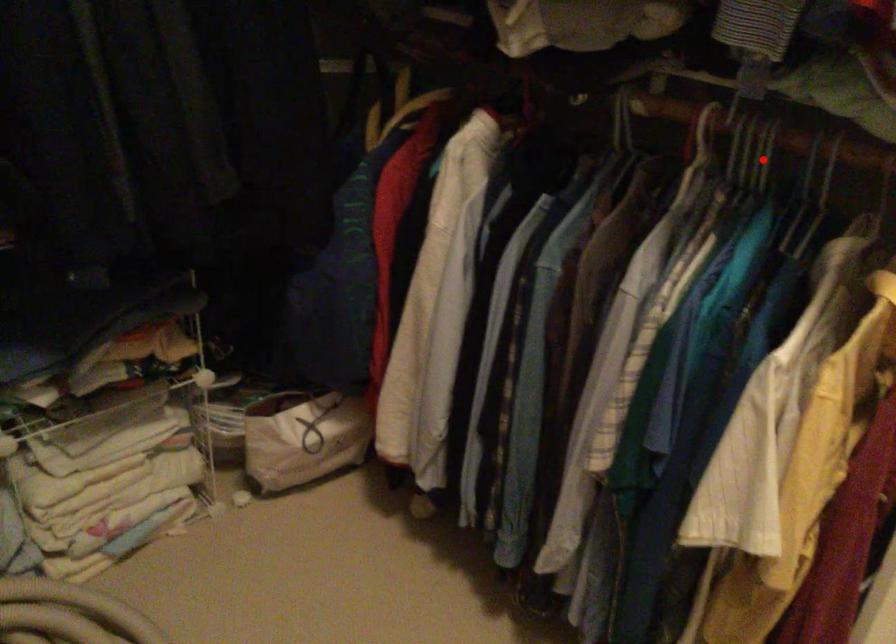
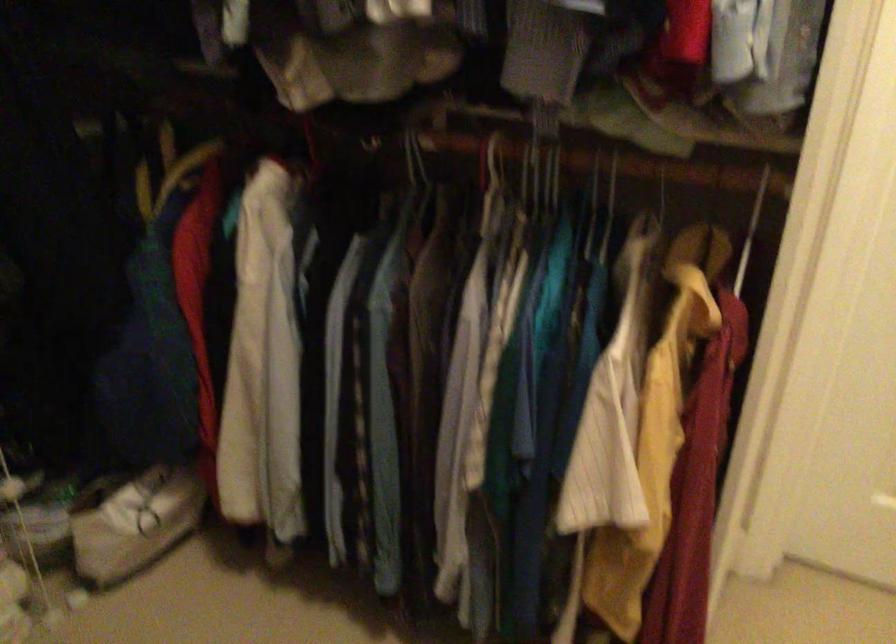
The point at the highlighted location is marked in the first image. Where is the corresponding point in the second image?

(554, 176)